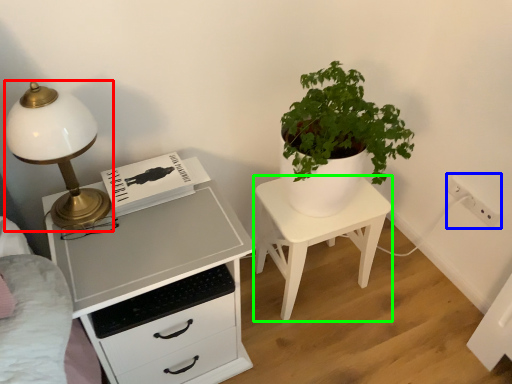
Question: Which object is positioned closest to lamp (highlighted by a red box)? Select from electric outlet (highlighted by a blue box) and nightstand (highlighted by a green box).

Choices:
 (A) electric outlet
 (B) nightstand

Answer: (B)